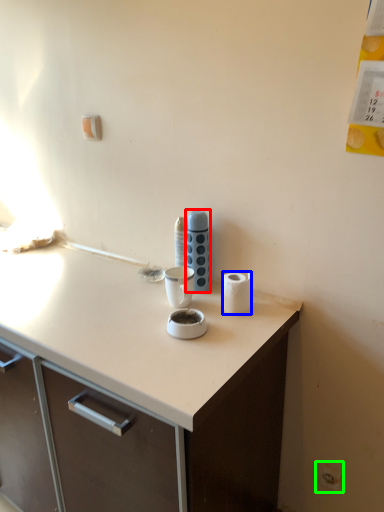
Question: Considering the real-world distances, which object is closest to appliance (highlighted by a red box)? paper towel (highlighted by a blue box) or electric outlet (highlighted by a green box).

Choices:
 (A) paper towel
 (B) electric outlet

Answer: (A)